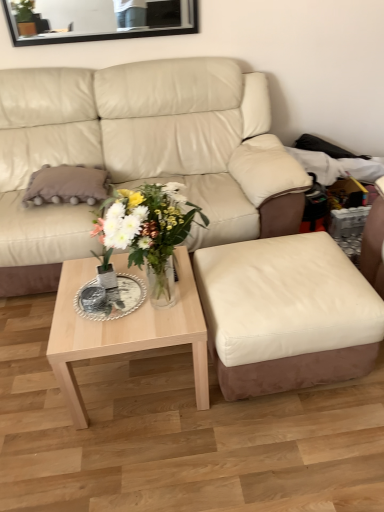
Image resolution: width=384 pixels, height=512 pixels. In order to click on vacant space that is to the left of clear glass vase at center in this screenshot , I will do `click(83, 313)`.